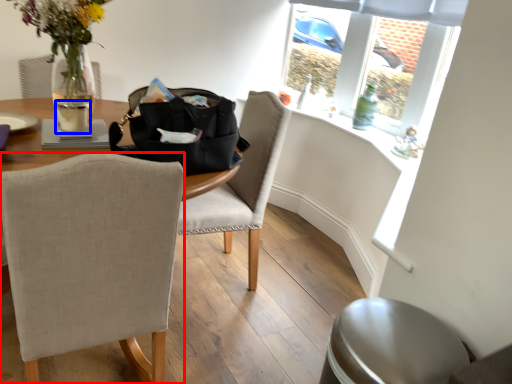
Question: Which of the following is the farthest to the observer, chair (highlighted by a red box) or beverage (highlighted by a blue box)?

Choices:
 (A) chair
 (B) beverage

Answer: (B)